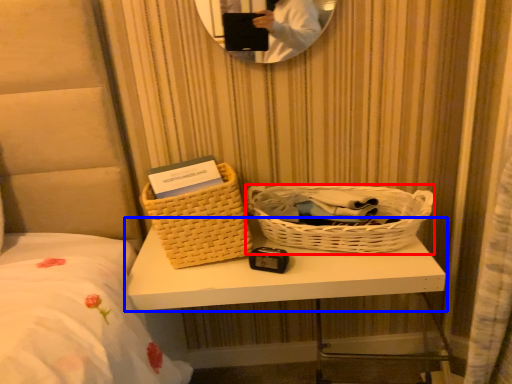
Question: Which object is further to the camera taking this photo, picnic basket (highlighted by a red box) or table (highlighted by a blue box)?

Choices:
 (A) picnic basket
 (B) table

Answer: (A)